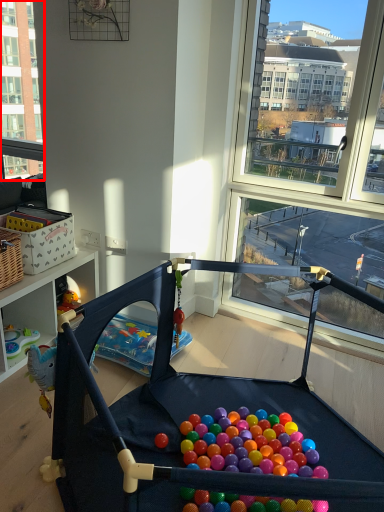
Question: From the image, what is the correct spatial relationship of window (annotated by the red box) in relation to baby carriage?

Choices:
 (A) left
 (B) right

Answer: (A)